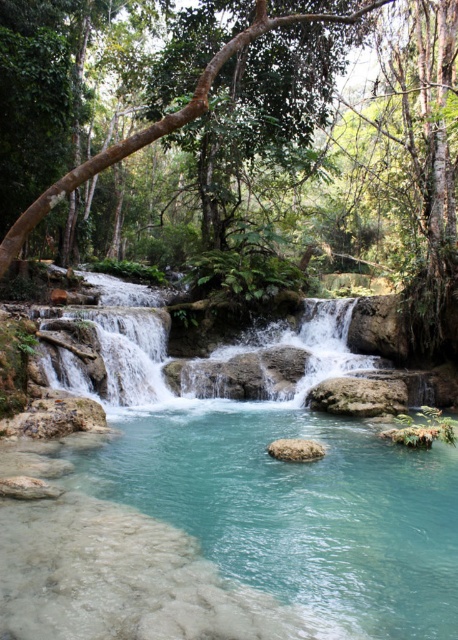
You are standing at the center of the image and want to locate the brown rough tree at center. Which direction should you look to find it?

The brown rough tree at center is located at point coordinates of (168, 116), so you should look to the upper left direction to find it.

You are planning to cross the clear glass stream at center and the clear stone waterfall at center. Which one would be easier to cross based on their sizes?

The clear glass stream at center is smaller than the clear stone waterfall at center, so it would be easier to cross the clear glass stream at center.

You are planning to cross the clear glass stream at center and the clear stone waterfall at center. Which path is narrower and safer for walking?

The clear glass stream at center is narrower than the clear stone waterfall at center, so it is safer to walk on the clear glass stream at center.